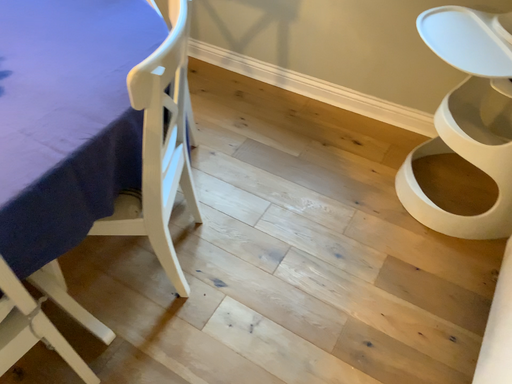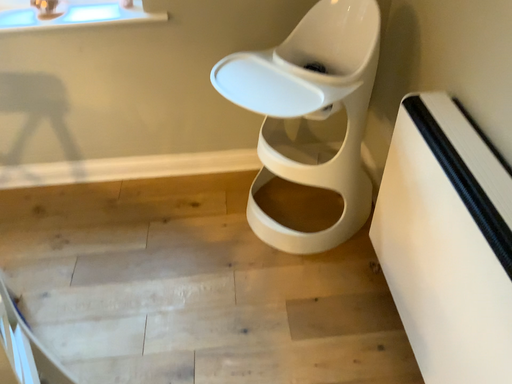
Question: How did the camera likely rotate when shooting the video?

Choices:
 (A) rotated right
 (B) rotated left

Answer: (A)